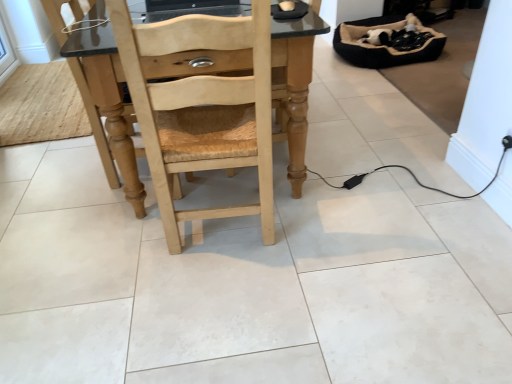
You are a GUI agent. You are given a task and a screenshot of the screen. Output one action in this format:
    pyautogui.click(x=<x>, y=<y>)
    Task: Click on the natural wood chair at center
    This screenshot has width=512, height=384.
    Given the screenshot: What is the action you would take?
    pyautogui.click(x=202, y=107)

The width and height of the screenshot is (512, 384). What do you see at coordinates (202, 107) in the screenshot?
I see `natural wood chair at center` at bounding box center [202, 107].

Image resolution: width=512 pixels, height=384 pixels. I want to click on natural wood chair at center, so click(202, 107).